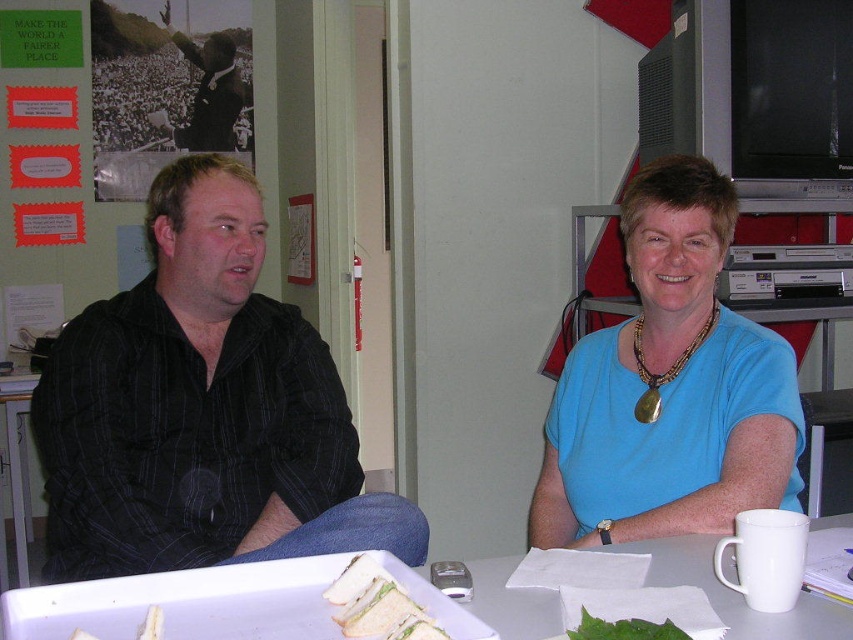
Looking at this image, can you confirm if black suit jacket at upper left is bigger than green leafy vegetable at lower center?

Indeed, black suit jacket at upper left has a larger size compared to green leafy vegetable at lower center.

What are the coordinates of `black suit jacket at upper left` in the screenshot? It's located at click(210, 92).

Based on the photo, is blue fabric shirt at center thinner than white bread sandwich at lower center?

No, blue fabric shirt at center is not thinner than white bread sandwich at lower center.

Where is `blue fabric shirt at center`? This screenshot has width=853, height=640. blue fabric shirt at center is located at coordinates (669, 387).

Can you confirm if white bread sandwich at lower center is positioned below green leafy vegetable at lower center?

No.

Can you confirm if white bread sandwich at lower center is smaller than green leafy vegetable at lower center?

A: No, white bread sandwich at lower center is not smaller than green leafy vegetable at lower center.

Between point (403, 598) and point (628, 634), which one is positioned in front?

Positioned in front is point (628, 634).

The image size is (853, 640). I want to click on white bread sandwich at lower center, so click(x=376, y=604).